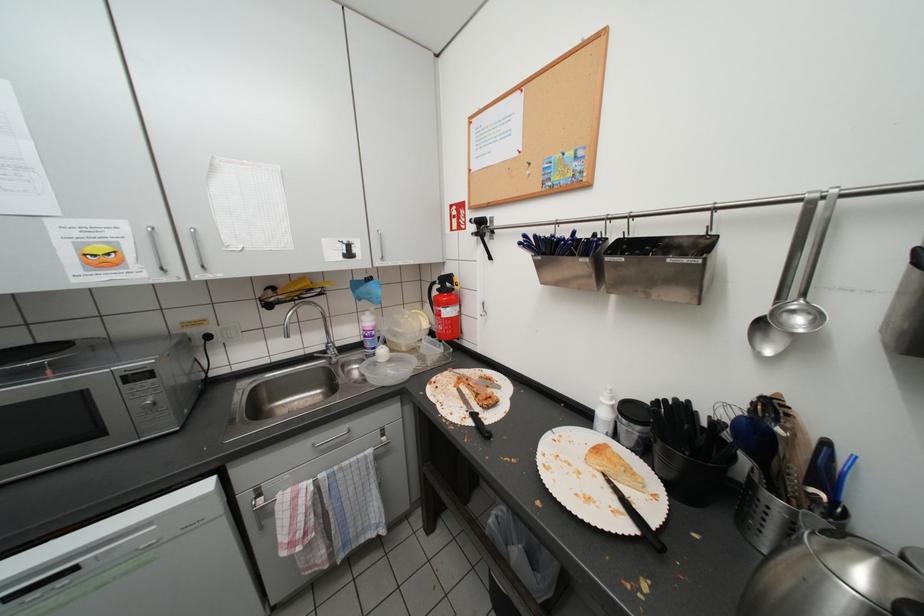
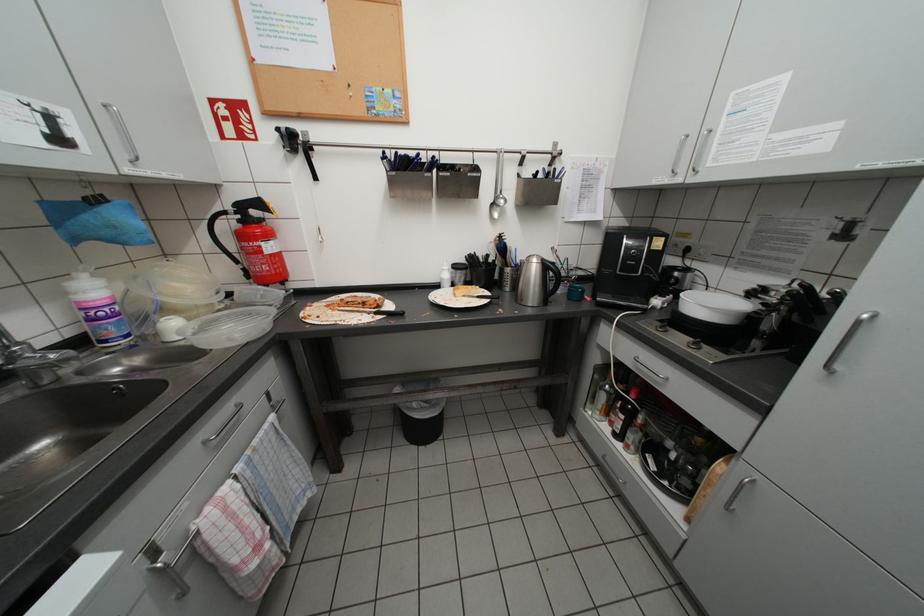
Question: The images are taken continuously from a first-person perspective. In which direction is your viewpoint rotating?

Choices:
 (A) Left
 (B) Right
 (C) Up
 (D) Down

Answer: (B)